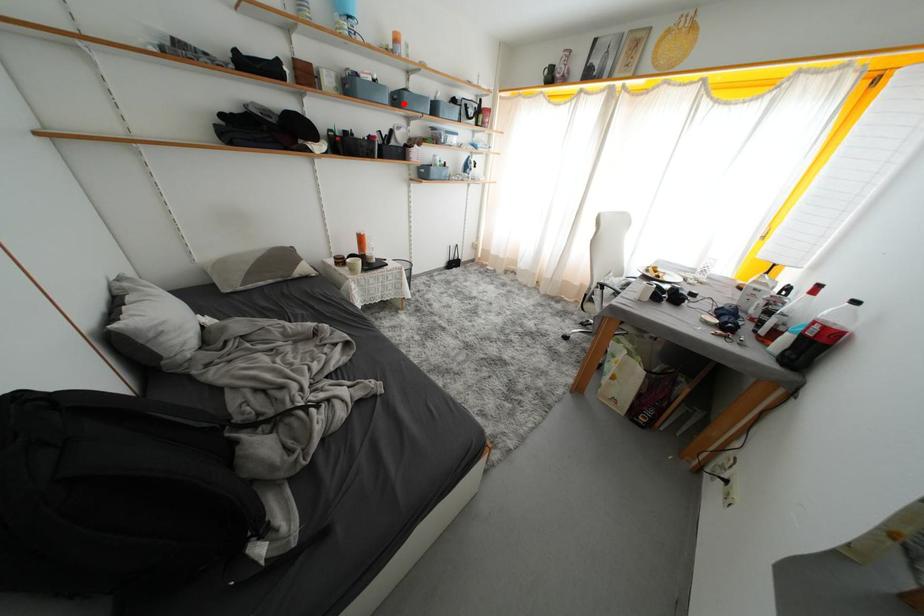
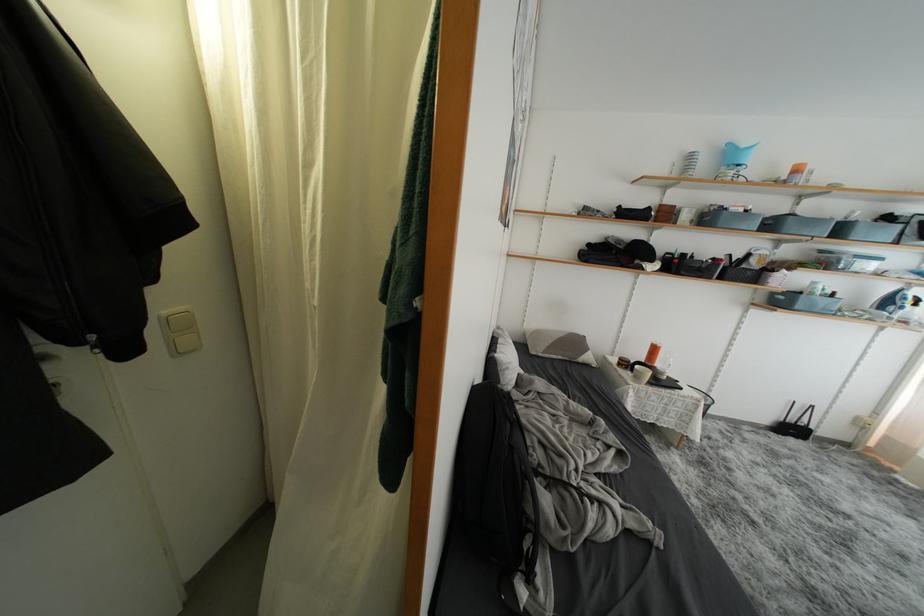
Question: I am providing you with two images of the same scene from different viewpoints. A red point is shown in image1. For the corresponding object point in image2, is it positioned nearer or farther from the camera?

Choices:
 (A) Nearer
 (B) Farther

Answer: (B)